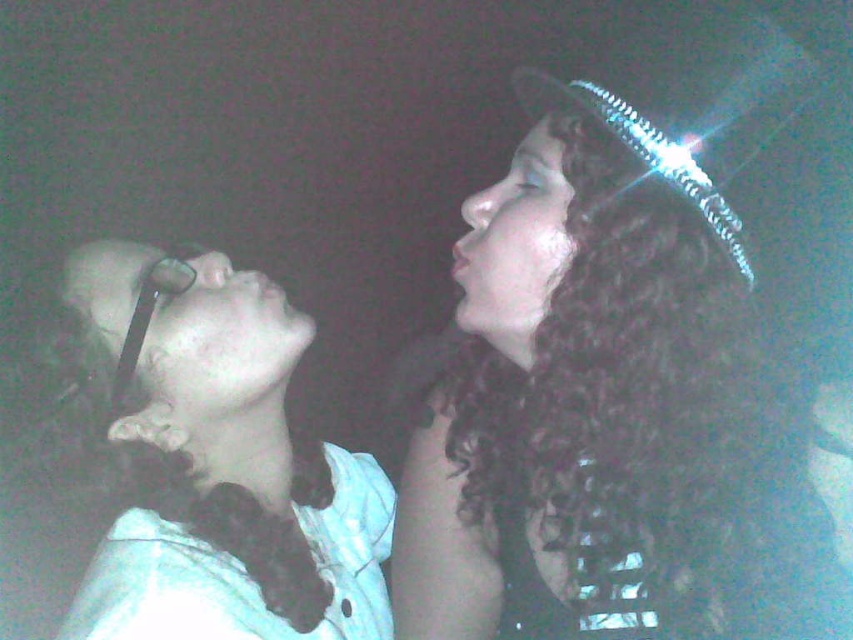
You are a photographer adjusting the lighting in this dimly lit scene. You need to ensure both the curly hair at upper right and the white lace collar at upper left are well illuminated. Based on their positions, which object should you focus the light on first to ensure proper exposure?

The curly hair at upper right is located above the white lace collar at upper left. Since it is higher in the frame, focusing the light on the curly hair at upper right first would ensure proper exposure starting from the top, then adjusting for the lower positioned white lace collar at upper left.

Based on the scene description, can you determine which object is taller between the curly hair at upper right and the white lace collar at upper left?

The curly hair at upper right is much taller than the white lace collar at upper left according to the description.

You are a photographer adjusting the camera settings to ensure both the curly hair at upper right and the white lace collar at upper left are in focus. Based on their widths, which object should you prioritize focusing on first to ensure proper framing?

The curly hair at upper right has a greater width compared to the white lace collar at upper left, so you should prioritize focusing on the curly hair at upper right first to ensure proper framing.